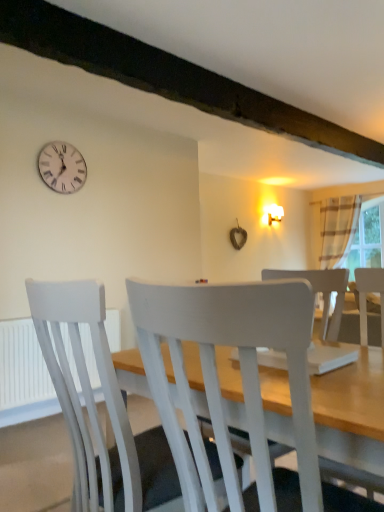
Question: Can you confirm if white painted wood chair at center, the first chair from the back, is positioned to the right of white plastic clock at upper left?

Choices:
 (A) yes
 (B) no

Answer: (A)

Question: Are white painted wood chair at center, placed as the second chair when sorted from front to back, and white plastic clock at upper left making contact?

Choices:
 (A) yes
 (B) no

Answer: (B)

Question: Can you confirm if white painted wood chair at center, placed as the second chair when sorted from front to back, is taller than white plastic clock at upper left?

Choices:
 (A) no
 (B) yes

Answer: (B)

Question: Would you say white painted wood chair at center, placed as the second chair when sorted from front to back, contains white plastic clock at upper left?

Choices:
 (A) yes
 (B) no

Answer: (B)

Question: Is white painted wood chair at center, the first chair from the back, positioned with its back to white plastic clock at upper left?

Choices:
 (A) yes
 (B) no

Answer: (B)

Question: From the image's perspective, is white plastic radiator at lower left positioned above or below striped fabric curtain at right?

Choices:
 (A) below
 (B) above

Answer: (A)

Question: Considering the positions of point (0, 322) and point (332, 303), is point (0, 322) closer or farther from the camera than point (332, 303)?

Choices:
 (A) closer
 (B) farther

Answer: (B)

Question: In terms of width, does white plastic radiator at lower left look wider or thinner when compared to striped fabric curtain at right?

Choices:
 (A) thin
 (B) wide

Answer: (A)

Question: In terms of size, does white plastic radiator at lower left appear bigger or smaller than striped fabric curtain at right?

Choices:
 (A) small
 (B) big

Answer: (A)

Question: From a real-world perspective, is white plastic radiator at lower left positioned above or below white painted wood chair at center, the first chair from the back?

Choices:
 (A) below
 (B) above

Answer: (A)

Question: Looking at their shapes, would you say white plastic radiator at lower left is wider or thinner than white painted wood chair at center, placed as the second chair when sorted from front to back?

Choices:
 (A) thin
 (B) wide

Answer: (A)

Question: In terms of size, does white plastic radiator at lower left appear bigger or smaller than white painted wood chair at center, the first chair from the back?

Choices:
 (A) big
 (B) small

Answer: (B)

Question: Relative to white painted wood chair at center, placed as the second chair when sorted from front to back, is white plastic radiator at lower left in front or behind?

Choices:
 (A) front
 (B) behind

Answer: (B)

Question: From the image's perspective, is striped fabric curtain at right above or below white painted wood chair at center, placed as the second chair when sorted from front to back?

Choices:
 (A) below
 (B) above

Answer: (B)

Question: Looking at the image, does striped fabric curtain at right seem bigger or smaller compared to white painted wood chair at center, placed as the second chair when sorted from front to back?

Choices:
 (A) big
 (B) small

Answer: (A)